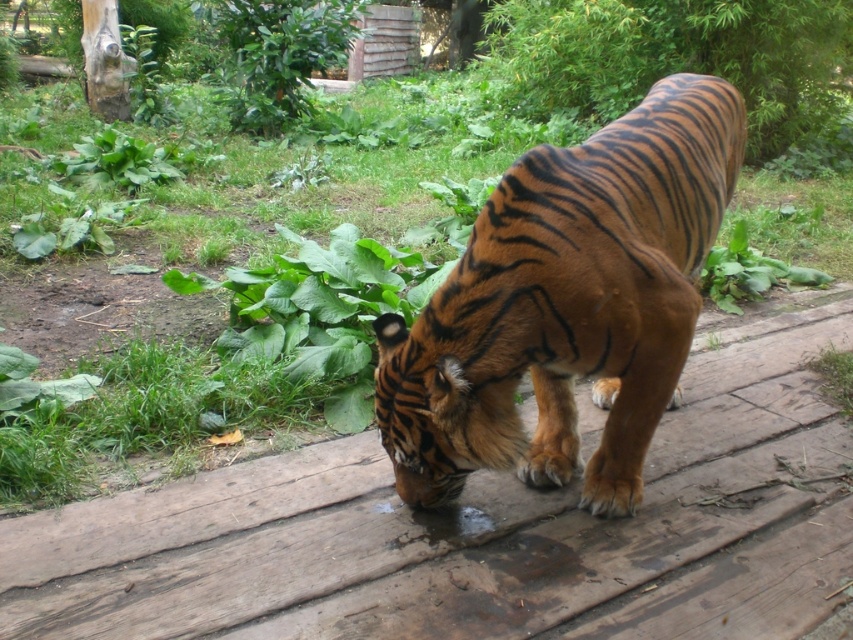
You are a zookeeper trying to clean the enclosure. You see the wooden plank at center and the green leafy grass at center. Which one is closer to you?

The wooden plank at center is closer to the viewer than the green leafy grass at center.